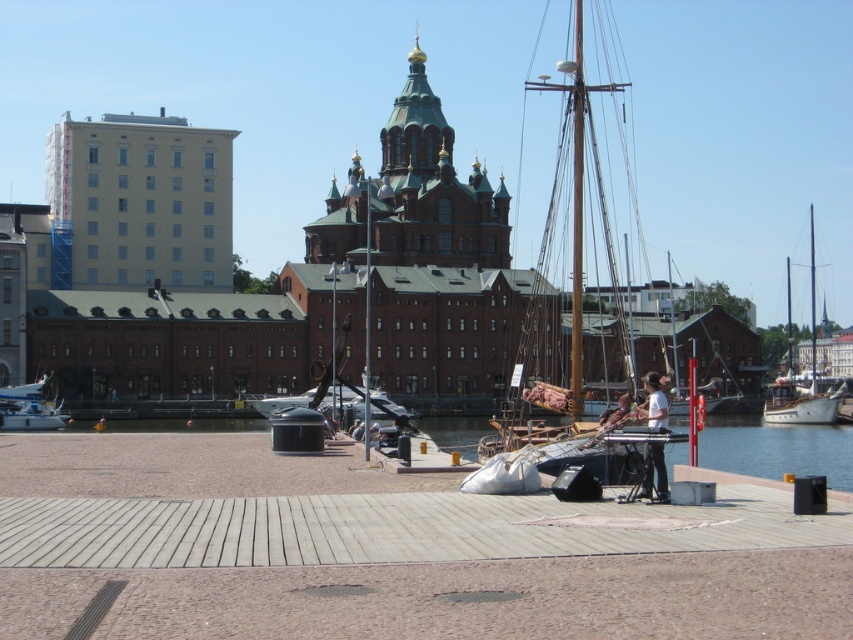
Is wooden mast sailboat at center wider than white plastic boat at lower left?

Yes, wooden mast sailboat at center is wider than white plastic boat at lower left.

Which is more to the right, wooden mast sailboat at center or white plastic boat at lower left?

Positioned to the right is wooden mast sailboat at center.

Locate an element on the screen. wooden mast sailboat at center is located at coordinates (573, 209).

Between wooden at center and wooden planks at center, which one has more height?

Standing taller between the two is wooden at center.

Can you confirm if wooden at center is positioned above wooden planks at center?

No, wooden at center is not above wooden planks at center.

This screenshot has height=640, width=853. I want to click on wooden at center, so click(x=387, y=550).

Does transparent plastic water at lower center have a lesser height compared to white plastic boat at lower left?

In fact, transparent plastic water at lower center may be taller than white plastic boat at lower left.

This screenshot has height=640, width=853. I want to click on transparent plastic water at lower center, so click(778, 449).

This screenshot has width=853, height=640. What are the coordinates of `transparent plastic water at lower center` in the screenshot? It's located at (778, 449).